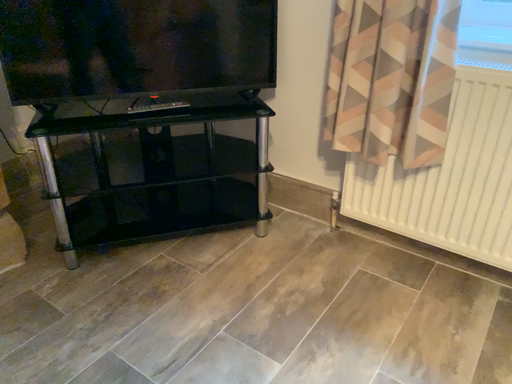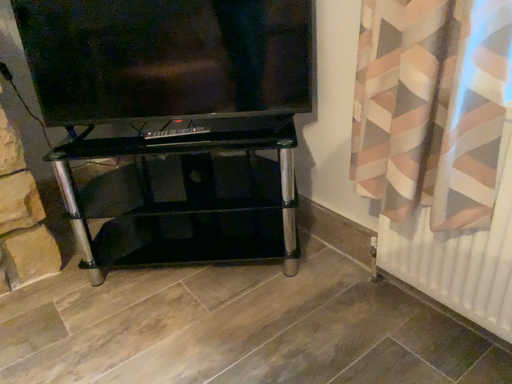
Question: How did the camera likely rotate when shooting the video?

Choices:
 (A) rotated right
 (B) rotated left

Answer: (B)